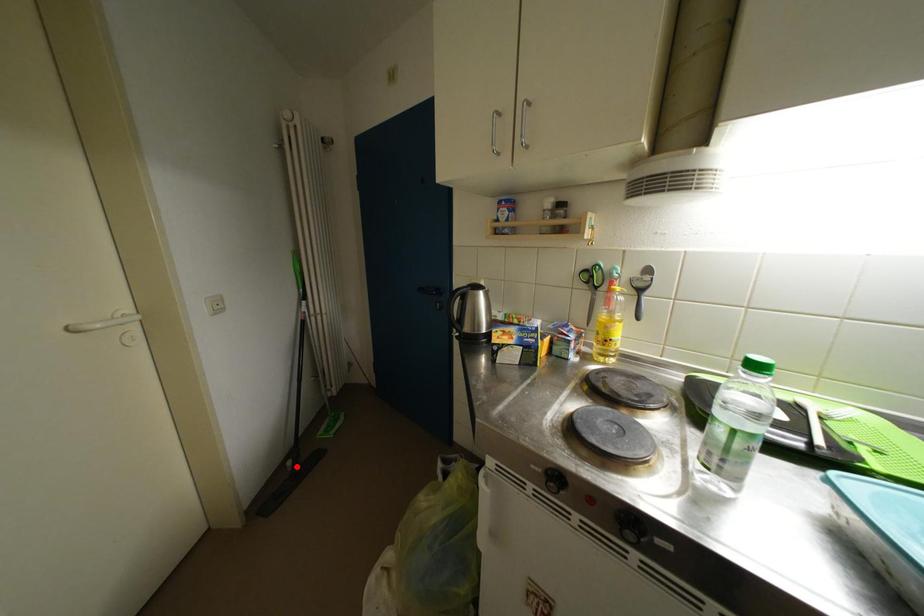
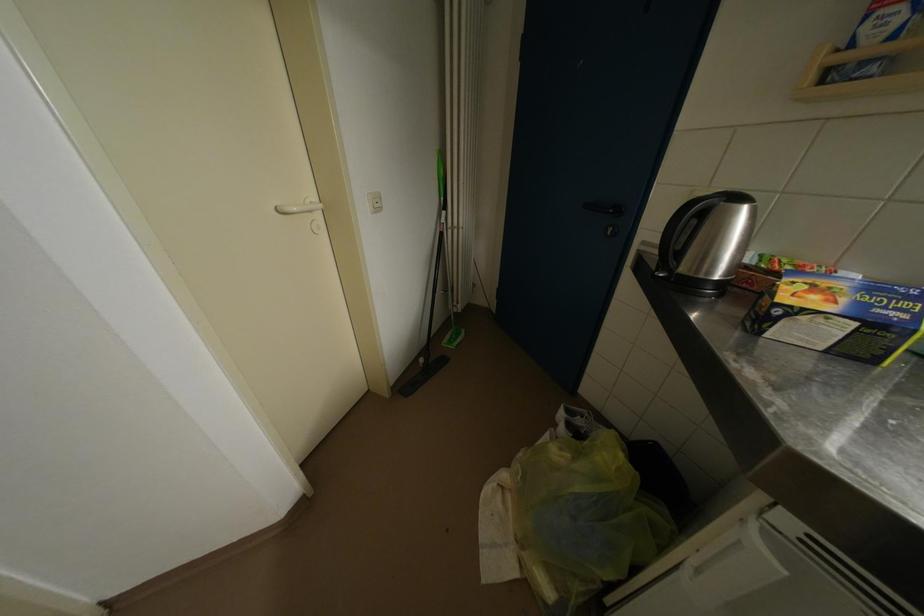
Question: A red point is marked in image1. In image2, is the corresponding 3D point closer to the camera or farther? Reply with the corresponding letter.

Choices:
 (A) The corresponding 3D point is closer.
 (B) The corresponding 3D point is farther.

Answer: (B)